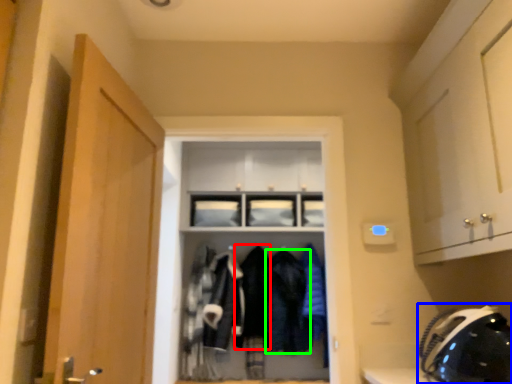
Question: Estimate the real-world distances between objects in this image. Which object is closer to clothing (highlighted by a red box), helmet (highlighted by a blue box) or clothing (highlighted by a green box)?

Choices:
 (A) helmet
 (B) clothing

Answer: (B)